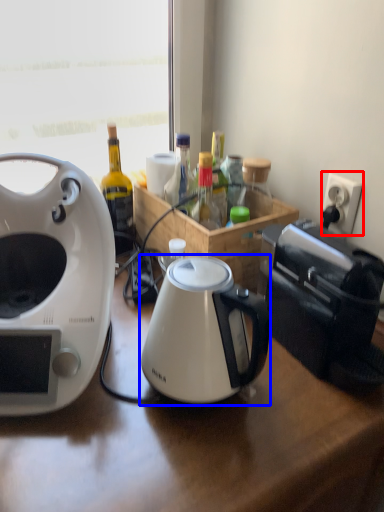
Question: Which of the following is the closest to the observer, power outlet (highlighted by a red box) or kettle (highlighted by a blue box)?

Choices:
 (A) power outlet
 (B) kettle

Answer: (B)